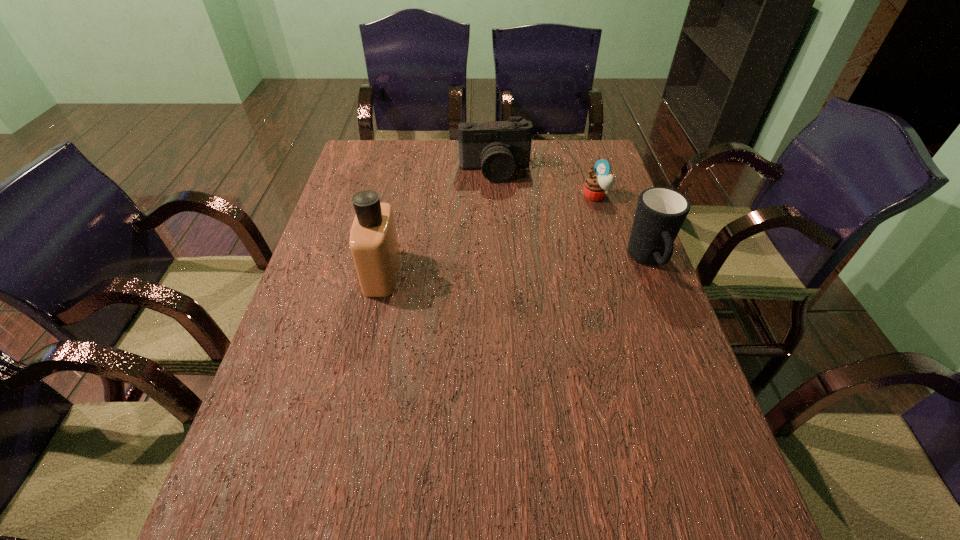
The height and width of the screenshot is (540, 960). I want to click on vacant area located on the front-facing side of the muffin, so tap(537, 250).

Find the location of a particular element. free point located 0.370m on the front-facing side of the muffin is located at coordinates (519, 265).

Where is `free location located 0.150m at the lens of the camera`? This screenshot has height=540, width=960. free location located 0.150m at the lens of the camera is located at coordinates (503, 212).

In order to click on vacant point located 0.130m at the lens of the camera in this screenshot , I will do `click(502, 208)`.

You are a GUI agent. You are given a task and a screenshot of the screen. Output one action in this format:
    pyautogui.click(x=<x>, y=<y>)
    Task: Click on the free spot located 0.310m at the lens of the camera
    
    Given the screenshot: What is the action you would take?
    pyautogui.click(x=510, y=247)

I want to click on object located in the far edge section of the desktop, so click(x=499, y=147).

Find the location of a particular element. object positioned at the left edge is located at coordinates (373, 242).

This screenshot has height=540, width=960. What are the coordinates of `mug that is at the right edge` in the screenshot? It's located at (660, 213).

Locate an element on the screen. The height and width of the screenshot is (540, 960). muffin that is at the right edge is located at coordinates coord(596,187).

What are the coordinates of `free spot at the far edge of the desktop` in the screenshot? It's located at (557, 142).